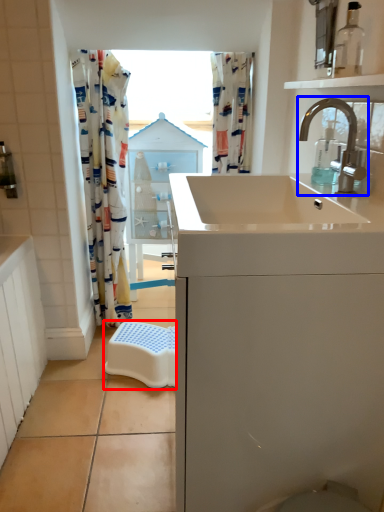
Question: Which object appears closest to the camera in this image, stool (highlighted by a red box) or tap (highlighted by a blue box)?

Choices:
 (A) stool
 (B) tap

Answer: (B)